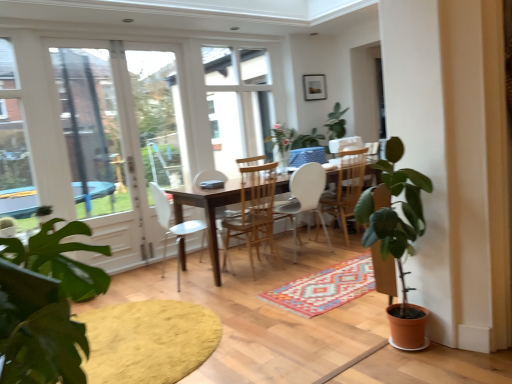
Identify the location of free location in front of white plastic chair at center, arranged as the 1th chair when viewed from the left. (206, 289).